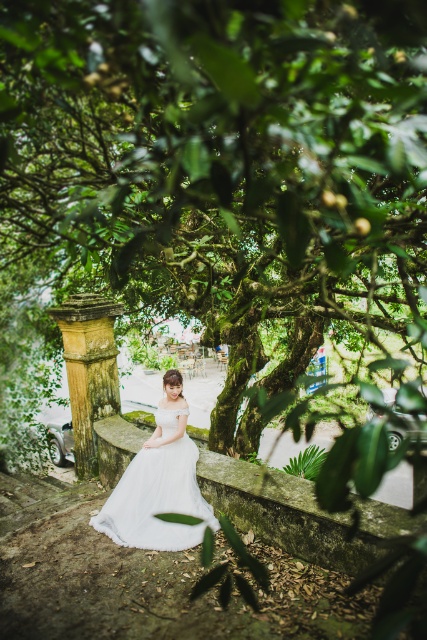
Which of these two, green mossy tree at center or white tulle dress at center, stands taller?

With more height is white tulle dress at center.

Between green mossy tree at center and white tulle dress at center, which one appears on the right side from the viewer's perspective?

Positioned to the right is green mossy tree at center.

At what (x,y) coordinates should I click in order to perform the action: click on green mossy tree at center. Please return your answer as a coordinate pair (x, y). Looking at the image, I should click on coord(222,164).

Is white tulle dress at center smaller than stone column at center?

Incorrect, white tulle dress at center is not smaller in size than stone column at center.

Who is higher up, white tulle dress at center or stone column at center?

Positioned higher is stone column at center.

Which is in front, point (102, 506) or point (87, 342)?

Point (102, 506) is more forward.

At what (x,y) coordinates should I click in order to perform the action: click on white tulle dress at center. Please return your answer as a coordinate pair (x, y). Looking at the image, I should click on (149, 488).

In the scene shown: Which is above, green mossy tree at center or stone column at center?

green mossy tree at center is above.

Does green mossy tree at center have a smaller size compared to stone column at center?

Correct, green mossy tree at center occupies less space than stone column at center.

Between point (216, 92) and point (73, 385), which one is positioned in front?

Positioned in front is point (216, 92).

Where is `green mossy tree at center`? green mossy tree at center is located at coordinates (222, 164).